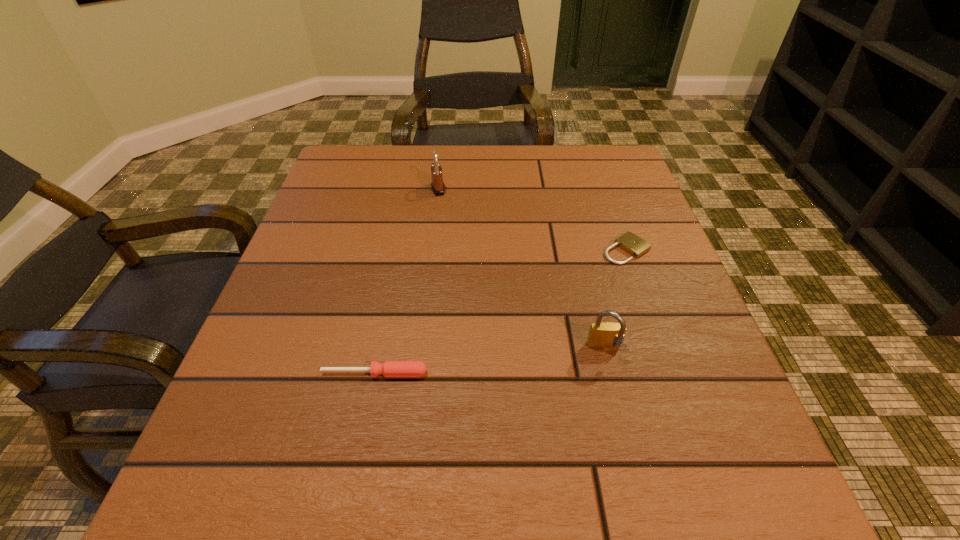
Find the location of a particular element. the farthest object is located at coordinates (437, 185).

This screenshot has height=540, width=960. What are the coordinates of `the leftmost padlock` in the screenshot? It's located at (437, 185).

Identify the location of the nearest padlock. (607, 335).

Where is `the second object from right to left`? This screenshot has width=960, height=540. the second object from right to left is located at coordinates pos(607,335).

You are a GUI agent. You are given a task and a screenshot of the screen. Output one action in this format:
    pyautogui.click(x=<x>, y=<y>)
    Task: Click on the nearest object
    
    Given the screenshot: What is the action you would take?
    pyautogui.click(x=389, y=368)

Image resolution: width=960 pixels, height=540 pixels. I want to click on screwdriver, so click(389, 368).

Locate an element on the screen. the rightmost padlock is located at coordinates (632, 244).

The height and width of the screenshot is (540, 960). I want to click on the second farthest padlock, so click(632, 244).

Locate an element on the screen. vacant space situated 0.180m on the right of the leftmost padlock is located at coordinates (521, 189).

In order to click on free space located 0.180m on the side with the combination dials of the second padlock from right to left in this screenshot , I will do `click(636, 473)`.